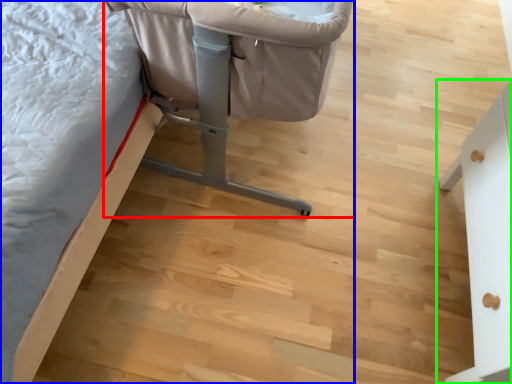
Question: Which object is positioned closest to furniture (highlighted by a red box)? Select from furniture (highlighted by a blue box) and furniture (highlighted by a green box).

Choices:
 (A) furniture
 (B) furniture

Answer: (A)